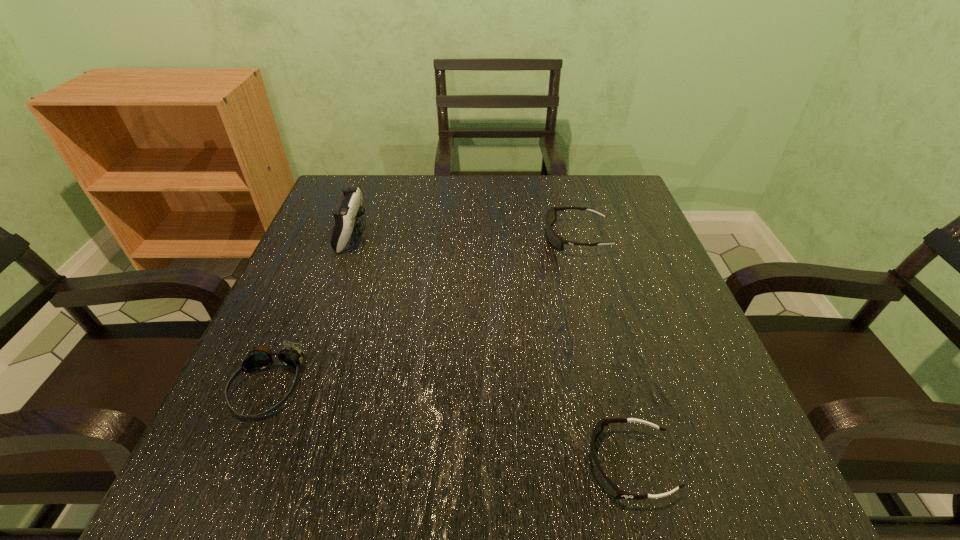
Identify which object is the third nearest to the shortest object. Please provide its 2D coordinates. Your answer should be formatted as a tuple, i.e. [(x, y)], where the tuple contains the x and y coordinates of a point satisfying the conditions above.

[(346, 217)]

Identify which object is the third nearest to the shortest object. Please provide its 2D coordinates. Your answer should be formatted as a tuple, i.e. [(x, y)], where the tuple contains the x and y coordinates of a point satisfying the conditions above.

[(346, 217)]

Locate which goggles ranks in proximity to the shortest object. Please provide its 2D coordinates. Your answer should be formatted as a tuple, i.e. [(x, y)], where the tuple contains the x and y coordinates of a point satisfying the conditions above.

[(555, 240)]

Select which goggles is the closest to the farthest goggles. Please provide its 2D coordinates. Your answer should be formatted as a tuple, i.e. [(x, y)], where the tuple contains the x and y coordinates of a point satisfying the conditions above.

[(612, 489)]

Locate an element on the screen. The height and width of the screenshot is (540, 960). vacant space that satisfies the following two spatial constraints: 1. on the front-facing side of the tallest object; 2. through the lenses of the leftmost goggles is located at coordinates (299, 386).

Identify the location of vacant area in the image that satisfies the following two spatial constraints: 1. on the front-facing side of the control; 2. through the lenses of the leftmost goggles. Image resolution: width=960 pixels, height=540 pixels. coord(299,386).

Locate an element on the screen. The height and width of the screenshot is (540, 960). vacant area in the image that satisfies the following two spatial constraints: 1. on the front-facing side of the control; 2. through the lenses of the second nearest goggles is located at coordinates (299, 386).